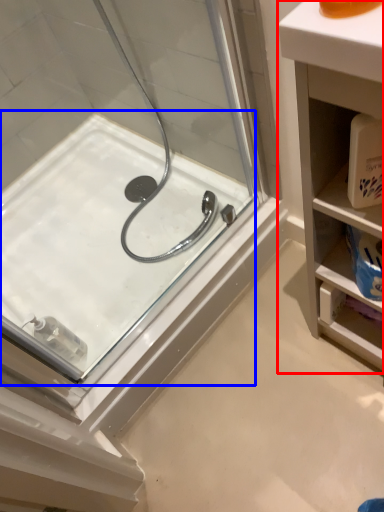
Question: Which of the following is the farthest to the observer, bathroom cabinet (highlighted by a red box) or bath (highlighted by a blue box)?

Choices:
 (A) bathroom cabinet
 (B) bath

Answer: (B)